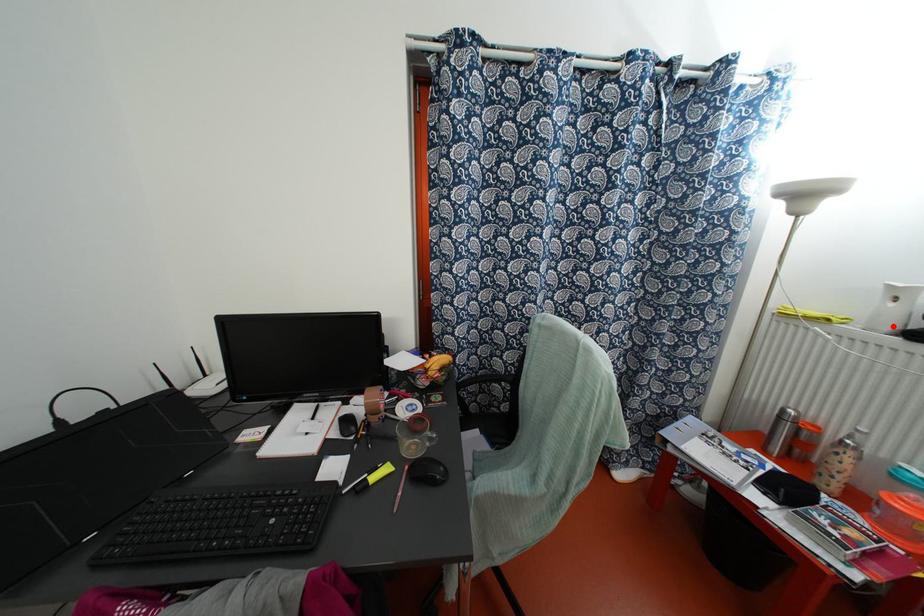
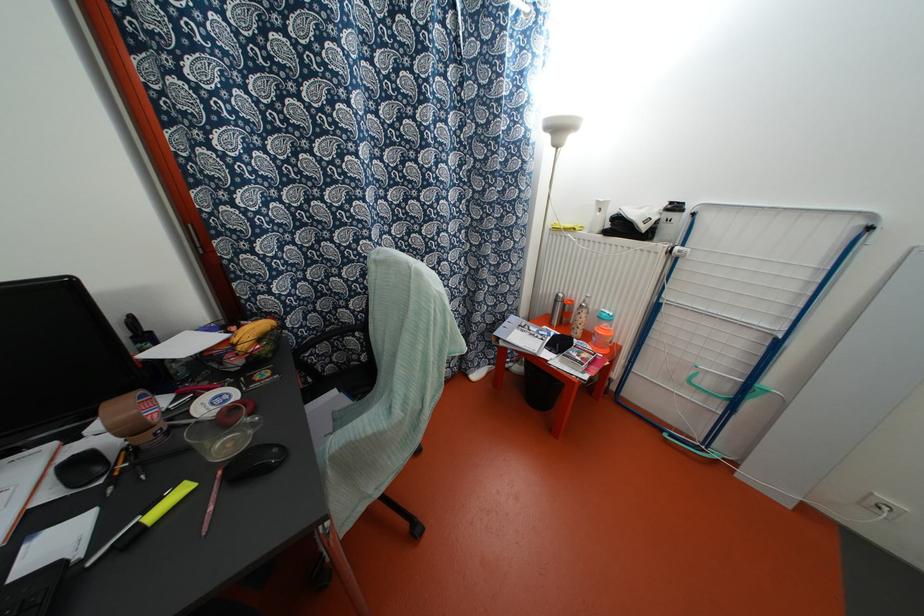
Where in the second image is the point corresponding to the highlighted location from the first image?

(599, 228)